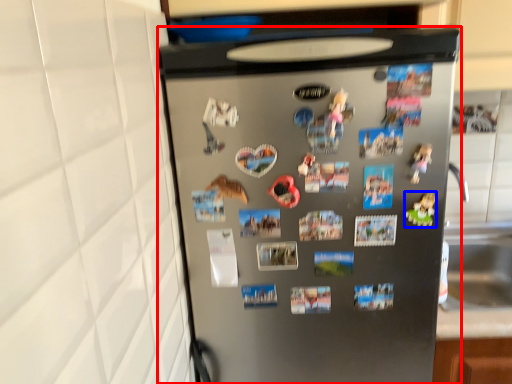
Question: Among these objects, which one is farthest to the camera, refrigerator (highlighted by a red box) or toy (highlighted by a blue box)?

Choices:
 (A) refrigerator
 (B) toy

Answer: (B)